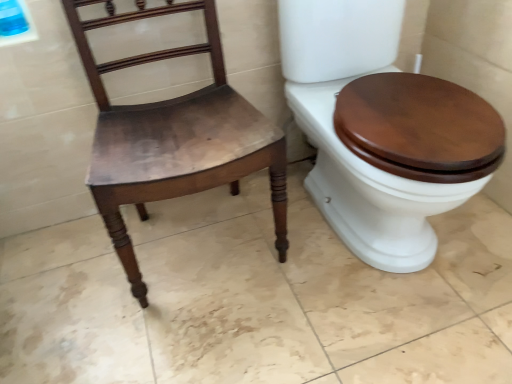
Question: Can you confirm if matte wood chair at left is shorter than wooden toilet seat at right?

Choices:
 (A) no
 (B) yes

Answer: (A)

Question: Can you confirm if matte wood chair at left is positioned to the left of wooden toilet seat at right?

Choices:
 (A) yes
 (B) no

Answer: (A)

Question: From the image's perspective, is matte wood chair at left on wooden toilet seat at right?

Choices:
 (A) yes
 (B) no

Answer: (B)

Question: From the image's perspective, is matte wood chair at left under wooden toilet seat at right?

Choices:
 (A) no
 (B) yes

Answer: (B)

Question: Is wooden toilet seat at right at the back of matte wood chair at left?

Choices:
 (A) yes
 (B) no

Answer: (B)

Question: Is matte wood chair at left closer to camera compared to wooden toilet seat at right?

Choices:
 (A) yes
 (B) no

Answer: (B)

Question: Considering the relative positions of wooden toilet seat at right and matte wood chair at left in the image provided, is wooden toilet seat at right in front of matte wood chair at left?

Choices:
 (A) yes
 (B) no

Answer: (A)

Question: Can we say wooden toilet seat at right lies outside matte wood chair at left?

Choices:
 (A) yes
 (B) no

Answer: (A)

Question: From the image's perspective, is wooden toilet seat at right on matte wood chair at left?

Choices:
 (A) no
 (B) yes

Answer: (B)

Question: Does wooden toilet seat at right have a smaller size compared to matte wood chair at left?

Choices:
 (A) yes
 (B) no

Answer: (B)

Question: Would you say matte wood chair at left is part of wooden toilet seat at right's contents?

Choices:
 (A) no
 (B) yes

Answer: (A)

Question: From a real-world perspective, is wooden toilet seat at right positioned under matte wood chair at left based on gravity?

Choices:
 (A) yes
 (B) no

Answer: (A)

Question: In terms of width, does matte wood chair at left look wider or thinner when compared to wooden toilet seat at right?

Choices:
 (A) wide
 (B) thin

Answer: (B)